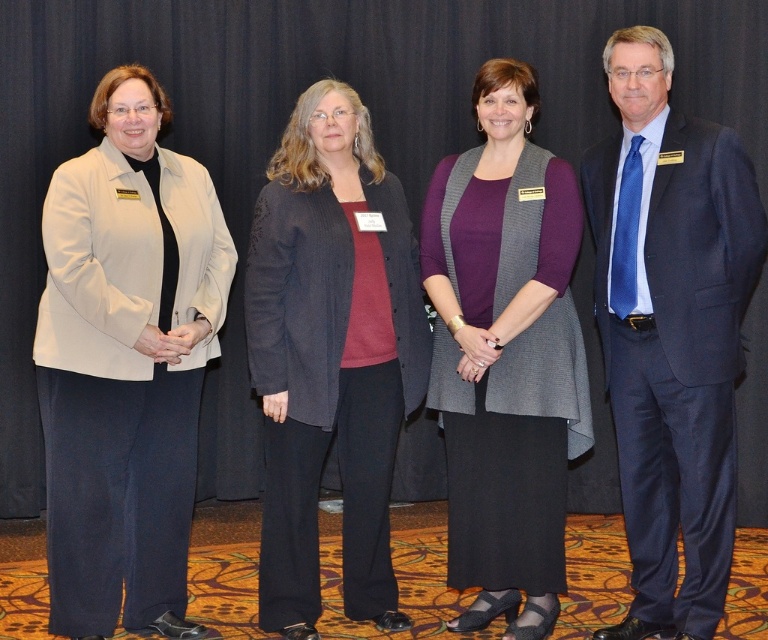
Question: Is dark gray textured cardigan at center bigger than purple matte sweater at center?

Choices:
 (A) no
 (B) yes

Answer: (B)

Question: Which point is farther to the camera?

Choices:
 (A) click(660, 176)
 (B) click(583, 442)
 (C) click(91, 556)
 (D) click(253, 371)

Answer: (B)

Question: Which point is closer to the camera taking this photo?

Choices:
 (A) (617, 634)
 (B) (60, 275)
 (C) (492, 461)
 (D) (366, 586)

Answer: (B)

Question: Is beige fabric jacket at left further to the viewer compared to blue textured suit at right?

Choices:
 (A) no
 (B) yes

Answer: (A)

Question: Can you confirm if blue textured suit at right is positioned to the left of purple matte sweater at center?

Choices:
 (A) no
 (B) yes

Answer: (A)

Question: Estimate the real-world distances between objects in this image. Which object is farther from the purple matte sweater at center?

Choices:
 (A) beige fabric jacket at left
 (B) dark gray textured cardigan at center

Answer: (A)